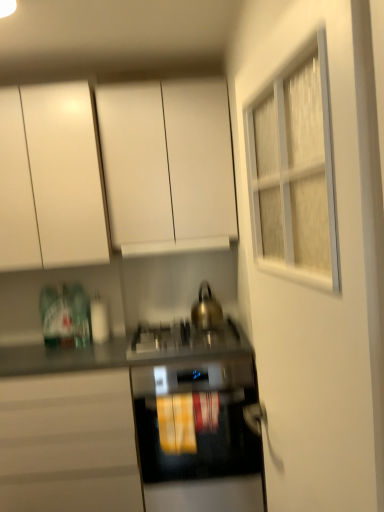
What do you see at coordinates (184, 340) in the screenshot?
I see `metallic silver gas stove at center` at bounding box center [184, 340].

The height and width of the screenshot is (512, 384). Describe the element at coordinates (206, 309) in the screenshot. I see `gold metallic kettle at center` at that location.

Identify the location of white matte cabinet at upper center, which ranks as the 1th cabinetry in top-to-bottom order. The image size is (384, 512). (118, 173).

The height and width of the screenshot is (512, 384). What are the coordinates of `matte white cabinet at lower left, the third cabinetry positioned from the top` in the screenshot? It's located at (68, 443).

The image size is (384, 512). I want to click on black glass oven at center, so click(196, 441).

This screenshot has height=512, width=384. I want to click on metallic silver gas stove at center, so click(x=184, y=340).

Is metallic silver gas stove at center wider or thinner than white matte cabinet at upper left, the 2th cabinetry in the top-to-bottom sequence?

In the image, metallic silver gas stove at center appears to be wider than white matte cabinet at upper left, the 2th cabinetry in the top-to-bottom sequence.

Is metallic silver gas stove at center shorter than white matte cabinet at upper left, the 2th cabinetry in the top-to-bottom sequence?

Correct, metallic silver gas stove at center is not as tall as white matte cabinet at upper left, the 2th cabinetry in the top-to-bottom sequence.

Starting from the metallic silver gas stove at center, which cabinetry is the 1st one behind? Please provide its 2D coordinates.

[(49, 179)]

Choose the correct answer: Is metallic silver gas stove at center inside white matte cabinet at upper left, arranged as the second cabinetry when ordered from the bottom, or outside it?

metallic silver gas stove at center is spatially situated outside white matte cabinet at upper left, arranged as the second cabinetry when ordered from the bottom.

Can you confirm if white glass door at upper right is wider than gold metallic kettle at center?

In fact, white glass door at upper right might be narrower than gold metallic kettle at center.

Could you tell me if white glass door at upper right is facing gold metallic kettle at center?

No, white glass door at upper right is not facing towards gold metallic kettle at center.

Can you confirm if white glass door at upper right is bigger than gold metallic kettle at center?

Yes, white glass door at upper right is bigger than gold metallic kettle at center.

In the scene shown: Can you confirm if white matte cabinet at upper center, which ranks as the 1th cabinetry in top-to-bottom order, is positioned to the right of gold metallic kettle at center?

No, white matte cabinet at upper center, which ranks as the 1th cabinetry in top-to-bottom order, is not to the right of gold metallic kettle at center.

Is the position of white matte cabinet at upper center, which ranks as the 1th cabinetry in top-to-bottom order, less distant than that of gold metallic kettle at center?

Yes, it is in front of gold metallic kettle at center.

In the scene shown: Is white matte cabinet at upper center, placed as the third cabinetry when sorted from bottom to top, touching gold metallic kettle at center?

white matte cabinet at upper center, placed as the third cabinetry when sorted from bottom to top, is not next to gold metallic kettle at center, and they're not touching.

Between point (68, 151) and point (205, 323), which one is positioned in front?

The point (68, 151) is more forward.

Is gold metallic kettle at center turned away from white matte cabinet at upper center, placed as the third cabinetry when sorted from bottom to top?

gold metallic kettle at center does not have its back to white matte cabinet at upper center, placed as the third cabinetry when sorted from bottom to top.

Consider the image. Considering the relative sizes of gold metallic kettle at center and white matte cabinet at upper center, which ranks as the 1th cabinetry in top-to-bottom order, in the image provided, is gold metallic kettle at center wider than white matte cabinet at upper center, which ranks as the 1th cabinetry in top-to-bottom order,?

In fact, gold metallic kettle at center might be narrower than white matte cabinet at upper center, which ranks as the 1th cabinetry in top-to-bottom order.

Could you measure the distance between gold metallic kettle at center and white matte cabinet at upper center, placed as the third cabinetry when sorted from bottom to top?

They are 32.84 inches apart.

Can you confirm if gold metallic kettle at center is shorter than white matte cabinet at upper center, placed as the third cabinetry when sorted from bottom to top?

Correct, gold metallic kettle at center is not as tall as white matte cabinet at upper center, placed as the third cabinetry when sorted from bottom to top.

How distant is green glass bottle at left, which is the 1th bottle from right to left, from black glass oven at center?

green glass bottle at left, which is the 1th bottle from right to left, and black glass oven at center are 32.18 inches apart.

Which point is more forward, (78, 284) or (261, 466)?

Point (261, 466)

There is a black glass oven at center. Where is `the 1st bottle above it (from a real-world perspective)`? Image resolution: width=384 pixels, height=512 pixels. the 1st bottle above it (from a real-world perspective) is located at coordinates (81, 316).

Is white matte cabinet at upper center, which ranks as the 1th cabinetry in top-to-bottom order, facing away from white matte cabinet at upper left, the 2th cabinetry in the top-to-bottom sequence?

That's not correct — white matte cabinet at upper center, which ranks as the 1th cabinetry in top-to-bottom order, is not looking away from white matte cabinet at upper left, the 2th cabinetry in the top-to-bottom sequence.

In the image, is white matte cabinet at upper center, placed as the third cabinetry when sorted from bottom to top, positioned in front of or behind white matte cabinet at upper left, arranged as the second cabinetry when ordered from the bottom?

Clearly, white matte cabinet at upper center, placed as the third cabinetry when sorted from bottom to top, is behind white matte cabinet at upper left, arranged as the second cabinetry when ordered from the bottom.

Is white matte cabinet at upper center, placed as the third cabinetry when sorted from bottom to top, to the left of white matte cabinet at upper left, arranged as the second cabinetry when ordered from the bottom, from the viewer's perspective?

In fact, white matte cabinet at upper center, placed as the third cabinetry when sorted from bottom to top, is to the right of white matte cabinet at upper left, arranged as the second cabinetry when ordered from the bottom.

From the image's perspective, is white matte cabinet at upper left, arranged as the second cabinetry when ordered from the bottom, beneath gold metallic kettle at center?

Incorrect, from the image's perspective, white matte cabinet at upper left, arranged as the second cabinetry when ordered from the bottom, is higher than gold metallic kettle at center.

Can you confirm if white matte cabinet at upper left, arranged as the second cabinetry when ordered from the bottom, is wider than gold metallic kettle at center?

Yes.

In the image, is white matte cabinet at upper left, the 2th cabinetry in the top-to-bottom sequence, positioned in front of or behind gold metallic kettle at center?

Visually, white matte cabinet at upper left, the 2th cabinetry in the top-to-bottom sequence, is located in front of gold metallic kettle at center.

Is white matte cabinet at upper left, arranged as the second cabinetry when ordered from the bottom, touching gold metallic kettle at center?

No, white matte cabinet at upper left, arranged as the second cabinetry when ordered from the bottom, is not next to gold metallic kettle at center.

Image resolution: width=384 pixels, height=512 pixels. What are the coordinates of `gas stove on the right of white matte cabinet at upper left, arranged as the second cabinetry when ordered from the bottom` in the screenshot? It's located at (184, 340).

I want to click on door in front of the gold metallic kettle at center, so 317,288.

When comparing their distances from white glass door at upper right, does matte white cabinet at lower left, which appears as the first cabinetry when ordered from the bottom, or translucent green bottle at left, which is the 2th bottle in right-to-left order, seem closer?

matte white cabinet at lower left, which appears as the first cabinetry when ordered from the bottom, lies closer to white glass door at upper right than the other object.

Which object lies further to the anchor point white matte cabinet at upper left, the 2th cabinetry in the top-to-bottom sequence, white matte cabinet at upper center, which ranks as the 1th cabinetry in top-to-bottom order, or white glass door at upper right?

Among the two, white glass door at upper right is located further to white matte cabinet at upper left, the 2th cabinetry in the top-to-bottom sequence.

Which object lies further to the anchor point white matte cabinet at upper left, arranged as the second cabinetry when ordered from the bottom, white matte cabinet at upper center, placed as the third cabinetry when sorted from bottom to top, or gold metallic kettle at center?

Based on the image, gold metallic kettle at center appears to be further to white matte cabinet at upper left, arranged as the second cabinetry when ordered from the bottom.

When comparing their distances from green glass bottle at left, which appears as the 2th bottle when viewed from the left, does translucent green bottle at left, which is the 2th bottle in right-to-left order, or metallic silver gas stove at center seem further?

Based on the image, metallic silver gas stove at center appears to be further to green glass bottle at left, which appears as the 2th bottle when viewed from the left.

Which object lies further to the anchor point green glass bottle at left, which is the 1th bottle from right to left, black glass oven at center or white matte exhaust hood at center?

black glass oven at center is positioned further to the anchor green glass bottle at left, which is the 1th bottle from right to left.

Looking at the image, which one is located further to black glass oven at center, gold metallic kettle at center or white glass door at upper right?

white glass door at upper right is positioned further to the anchor black glass oven at center.

Based on their spatial positions, is white glass door at upper right or white matte cabinet at upper center, placed as the third cabinetry when sorted from bottom to top, further from green glass bottle at left, which is the 1th bottle from right to left?

The object further to green glass bottle at left, which is the 1th bottle from right to left, is white glass door at upper right.

Estimate the real-world distances between objects in this image. Which object is further from white matte cabinet at upper left, the 2th cabinetry in the top-to-bottom sequence, matte white cabinet at lower left, the third cabinetry positioned from the top, or white glass door at upper right?

Based on the image, white glass door at upper right appears to be further to white matte cabinet at upper left, the 2th cabinetry in the top-to-bottom sequence.

Find the location of a particular element. kitchen appliance between white matte cabinet at upper left, the 2th cabinetry in the top-to-bottom sequence, and black glass oven at center vertically is located at coordinates (206, 309).

Where is `exhaust hood between green glass bottle at left, which appears as the 2th bottle when viewed from the left, and metallic silver gas stove at center, in the horizontal direction`? The height and width of the screenshot is (512, 384). exhaust hood between green glass bottle at left, which appears as the 2th bottle when viewed from the left, and metallic silver gas stove at center, in the horizontal direction is located at coordinates (175, 247).

This screenshot has width=384, height=512. In order to click on gas stove located between translucent green bottle at left, which is the 2th bottle in right-to-left order, and gold metallic kettle at center in the left-right direction in this screenshot , I will do `click(184, 340)`.

At what (x,y) coordinates should I click in order to perform the action: click on gas stove between white matte cabinet at upper center, placed as the third cabinetry when sorted from bottom to top, and black glass oven at center, in the vertical direction. Please return your answer as a coordinate pair (x, y). Looking at the image, I should click on (184, 340).